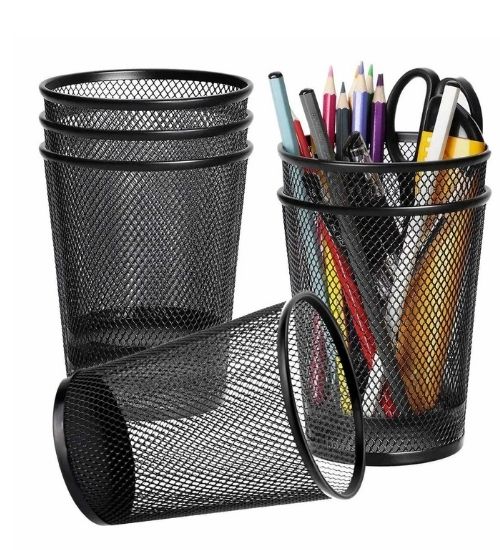
The height and width of the screenshot is (550, 500). I want to click on pencil holder cup rims, so click(x=157, y=102), click(x=159, y=135), click(x=159, y=161), click(x=292, y=407), click(x=353, y=210), click(x=369, y=169).